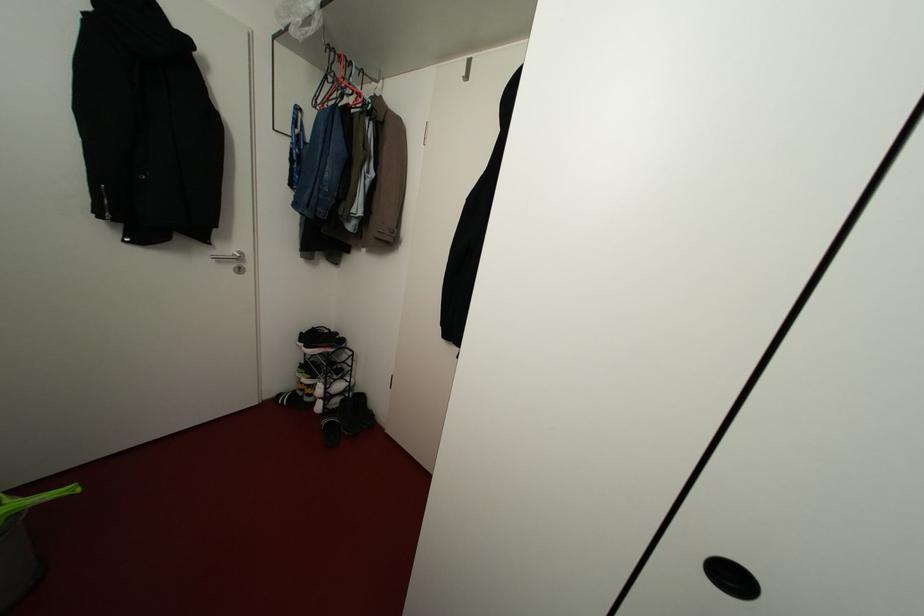
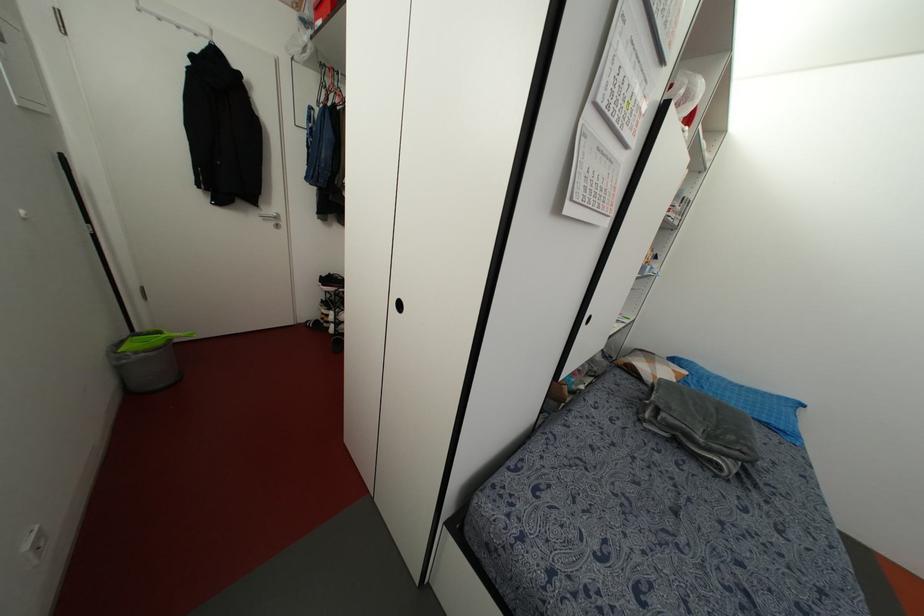
Where in the second image is the point corresponding to (x=306, y=399) from the first image?

(324, 323)